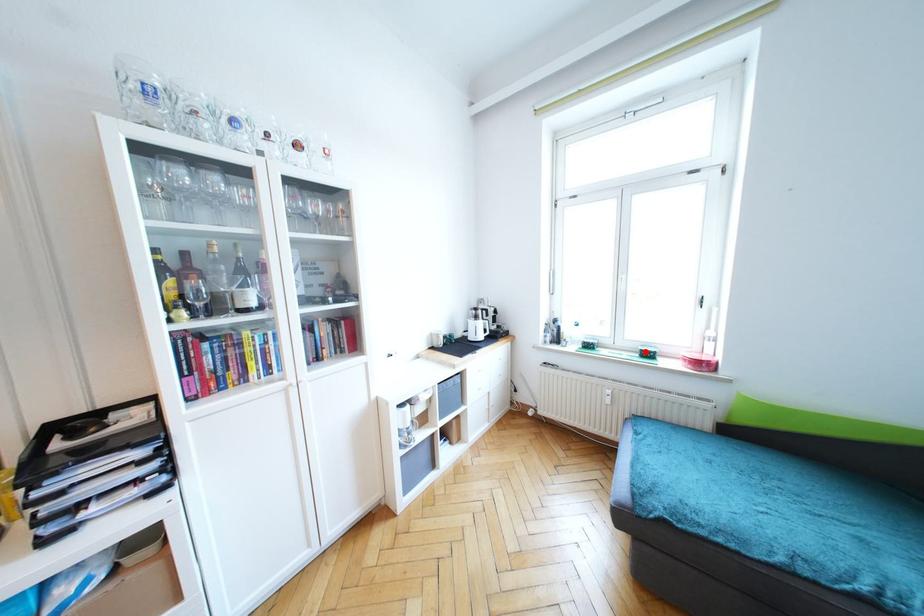
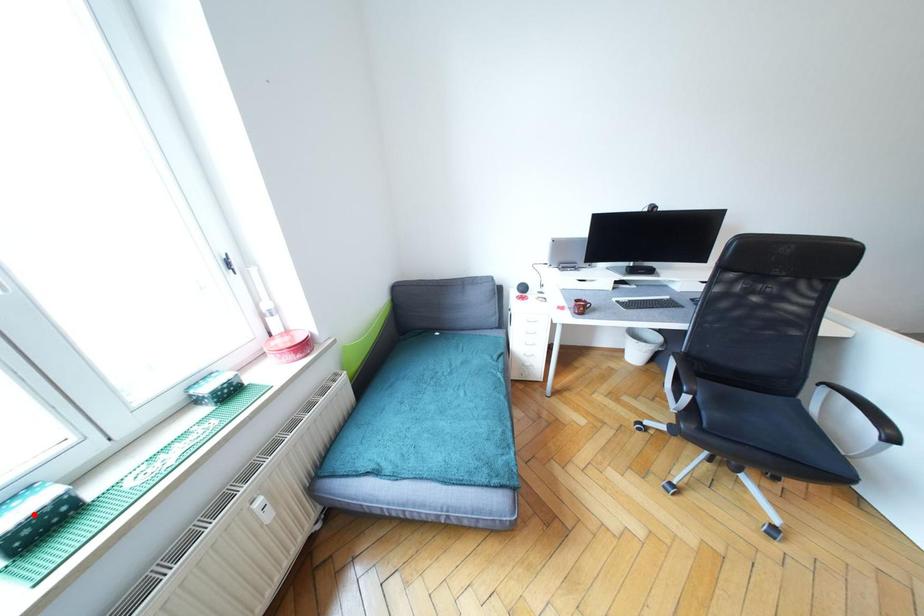
I am providing you with two images of the same scene from different viewpoints. A red point is marked on the first image and another point is marked on the second image. Do the highlighted points in image1 and image2 indicate the same real-world spot?

No